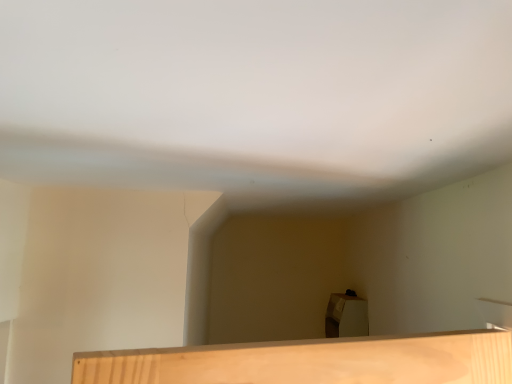
Describe the element at coordinates (346, 316) in the screenshot. I see `matte white cabinet at lower center` at that location.

Identify the location of matte white cabinet at lower center. (346, 316).

In order to face matte white cabinet at lower center, should I rotate leftwards or rightwards?

To align with it, rotate right about 11.706°.

Identify the location of matte white cabinet at lower center. (346, 316).